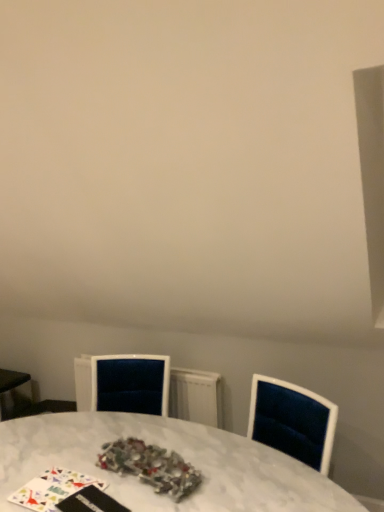
This screenshot has height=512, width=384. Describe the element at coordinates (151, 466) in the screenshot. I see `shiny metallic tinsel at center` at that location.

Identify the location of velvet radiator at center. (147, 388).

Is white marble table at center bigger than shiny metallic tinsel at center?

Indeed, white marble table at center has a larger size compared to shiny metallic tinsel at center.

Is white marble table at center facing towards shiny metallic tinsel at center?

No, white marble table at center is not oriented towards shiny metallic tinsel at center.

From the image's perspective, which object appears higher, white marble table at center or shiny metallic tinsel at center?

shiny metallic tinsel at center is shown above in the image.

Is white marble table at center surrounded by shiny metallic tinsel at center?

No, white marble table at center is not surrounded by shiny metallic tinsel at center.

Considering the sizes of shiny metallic tinsel at center and white marble table at center in the image, is shiny metallic tinsel at center bigger or smaller than white marble table at center?

Considering their sizes, shiny metallic tinsel at center takes up less space than white marble table at center.

Is shiny metallic tinsel at center not near white marble table at center?

No, shiny metallic tinsel at center is not far from white marble table at center.

Between shiny metallic tinsel at center and white marble table at center, which one has smaller width?

With smaller width is shiny metallic tinsel at center.

From the image's perspective, which one is positioned lower, white marble table at center or velvet radiator at center?

white marble table at center is shown below in the image.

Between point (75, 438) and point (83, 392), which one is positioned in front?

The point (75, 438) is in front.

From a real-world perspective, which is physically below, white marble table at center or velvet radiator at center?

white marble table at center is physically lower.

Find the location of a particular element. The height and width of the screenshot is (512, 384). radiator on the left side of white marble table at center is located at coordinates (147, 388).

You are a GUI agent. You are given a task and a screenshot of the screen. Output one action in this format:
    pyautogui.click(x=<x>, y=<y>)
    Task: Click on the christmas decoration above the velvet radiator at center (from the image's perspective)
    Image resolution: width=384 pixels, height=512 pixels.
    Given the screenshot: What is the action you would take?
    pyautogui.click(x=151, y=466)

Considering the positions of objects shiny metallic tinsel at center and velvet radiator at center in the image provided, who is more to the right, shiny metallic tinsel at center or velvet radiator at center?

Positioned to the right is shiny metallic tinsel at center.

From a real-world perspective, is shiny metallic tinsel at center over velvet radiator at center?

Correct, in the physical world, shiny metallic tinsel at center is higher than velvet radiator at center.

From the image's perspective, which is below, shiny metallic tinsel at center or velvet radiator at center?

velvet radiator at center is shown below in the image.

Can you confirm if velvet radiator at center is positioned to the left of shiny metallic tinsel at center?

Indeed, velvet radiator at center is positioned on the left side of shiny metallic tinsel at center.

Is velvet radiator at center next to shiny metallic tinsel at center and touching it?

No.

Could you tell me if velvet radiator at center is facing shiny metallic tinsel at center?

Yes, velvet radiator at center is aimed at shiny metallic tinsel at center.

Considering the sizes of objects velvet radiator at center and shiny metallic tinsel at center in the image provided, who is shorter, velvet radiator at center or shiny metallic tinsel at center?

With less height is shiny metallic tinsel at center.

Which is behind, velvet radiator at center or white marble table at center?

velvet radiator at center is further away from the camera.

The height and width of the screenshot is (512, 384). I want to click on radiator that appears above the white marble table at center (from a real-world perspective), so click(x=147, y=388).

Based on the photo, are velvet radiator at center and white marble table at center far apart?

That's not correct — velvet radiator at center is a little close to white marble table at center.

Can you confirm if velvet radiator at center is positioned to the left of white marble table at center?

Correct, you'll find velvet radiator at center to the left of white marble table at center.

This screenshot has width=384, height=512. Identify the location of christmas decoration that appears behind the white marble table at center. pos(151,466).

Locate an element on the screen. Image resolution: width=384 pixels, height=512 pixels. table below the shiny metallic tinsel at center (from the image's perspective) is located at coordinates (168, 449).

From the image, which object appears to be nearer to velvet radiator at center, white marble table at center or shiny metallic tinsel at center?

Answer: Based on the image, white marble table at center appears to be nearer to velvet radiator at center.

Based on their spatial positions, is velvet radiator at center or white marble table at center further from shiny metallic tinsel at center?

Among the two, velvet radiator at center is located further to shiny metallic tinsel at center.

Considering their positions, is white marble table at center positioned further to shiny metallic tinsel at center than velvet radiator at center?

The object further to shiny metallic tinsel at center is velvet radiator at center.

Which object lies nearer to the anchor point velvet radiator at center, shiny metallic tinsel at center or white marble table at center?

white marble table at center.

Considering their positions, is velvet radiator at center positioned closer to white marble table at center than shiny metallic tinsel at center?

shiny metallic tinsel at center.

Based on their spatial positions, is shiny metallic tinsel at center or velvet radiator at center closer to white marble table at center?

Among the two, shiny metallic tinsel at center is located nearer to white marble table at center.

The width and height of the screenshot is (384, 512). In order to click on christmas decoration between white marble table at center and velvet radiator at center along the z-axis in this screenshot , I will do `click(151, 466)`.